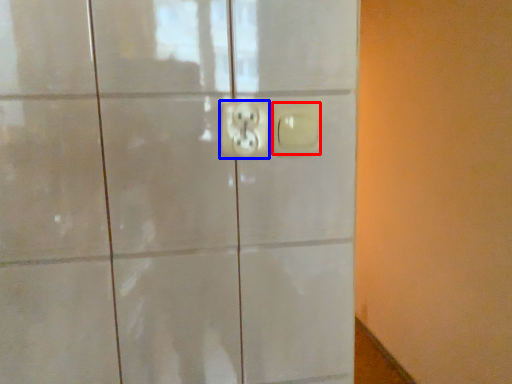
Question: Which point is further to the camera, light switch (highlighted by a red box) or power plugs and sockets (highlighted by a blue box)?

Choices:
 (A) light switch
 (B) power plugs and sockets

Answer: (A)